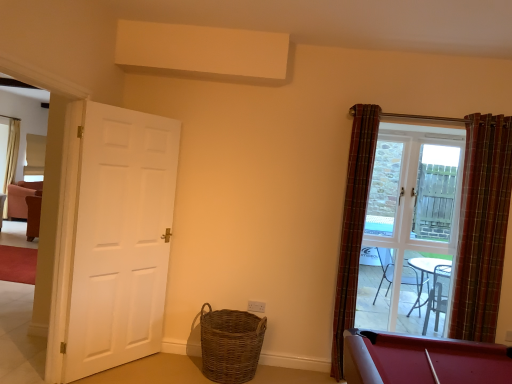
Question: Could plaid fabric curtain at right, which is counted as the first curtain, starting from the left, be considered to be inside plaid fabric curtain at right, which is counted as the first curtain, starting from the right?

Choices:
 (A) yes
 (B) no

Answer: (B)

Question: From the image's perspective, is plaid fabric curtain at right, placed as the 2th curtain when sorted from left to right, under plaid fabric curtain at right, which is counted as the first curtain, starting from the left?

Choices:
 (A) no
 (B) yes

Answer: (A)

Question: From a real-world perspective, does plaid fabric curtain at right, placed as the 2th curtain when sorted from left to right, stand above plaid fabric curtain at right, which is counted as the first curtain, starting from the left?

Choices:
 (A) no
 (B) yes

Answer: (B)

Question: Is plaid fabric curtain at right, which is counted as the first curtain, starting from the right, far from plaid fabric curtain at right, the second curtain viewed from the right?

Choices:
 (A) no
 (B) yes

Answer: (A)

Question: Can you confirm if plaid fabric curtain at right, placed as the 2th curtain when sorted from left to right, is taller than plaid fabric curtain at right, which is counted as the first curtain, starting from the left?

Choices:
 (A) no
 (B) yes

Answer: (A)

Question: In terms of height, does woven brown basket at lower center look taller or shorter compared to clear glass door at right?

Choices:
 (A) tall
 (B) short

Answer: (B)

Question: In terms of size, does woven brown basket at lower center appear bigger or smaller than clear glass door at right?

Choices:
 (A) small
 (B) big

Answer: (B)

Question: Considering their positions, is woven brown basket at lower center located in front of or behind clear glass door at right?

Choices:
 (A) behind
 (B) front

Answer: (B)

Question: Visually, is woven brown basket at lower center positioned to the left or to the right of clear glass door at right?

Choices:
 (A) right
 (B) left

Answer: (B)

Question: From a real-world perspective, is clear glass door at right above or below woven brown basket at lower center?

Choices:
 (A) above
 (B) below

Answer: (A)

Question: Looking at the image, does clear glass door at right seem bigger or smaller compared to woven brown basket at lower center?

Choices:
 (A) big
 (B) small

Answer: (B)

Question: Is clear glass door at right taller or shorter than woven brown basket at lower center?

Choices:
 (A) short
 (B) tall

Answer: (B)

Question: Considering the relative positions of clear glass door at right and woven brown basket at lower center in the image provided, is clear glass door at right to the left or to the right of woven brown basket at lower center?

Choices:
 (A) right
 (B) left

Answer: (A)

Question: Looking at their shapes, would you say plaid fabric curtain at right, which is counted as the first curtain, starting from the right, is wider or thinner than white matte door at left?

Choices:
 (A) wide
 (B) thin

Answer: (A)

Question: From a real-world perspective, is plaid fabric curtain at right, placed as the 2th curtain when sorted from left to right, above or below white matte door at left?

Choices:
 (A) above
 (B) below

Answer: (A)